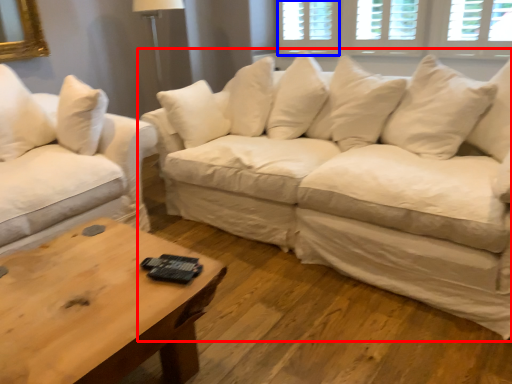
Question: Among these objects, which one is nearest to the camera, studio couch (highlighted by a red box) or window (highlighted by a blue box)?

Choices:
 (A) studio couch
 (B) window

Answer: (A)